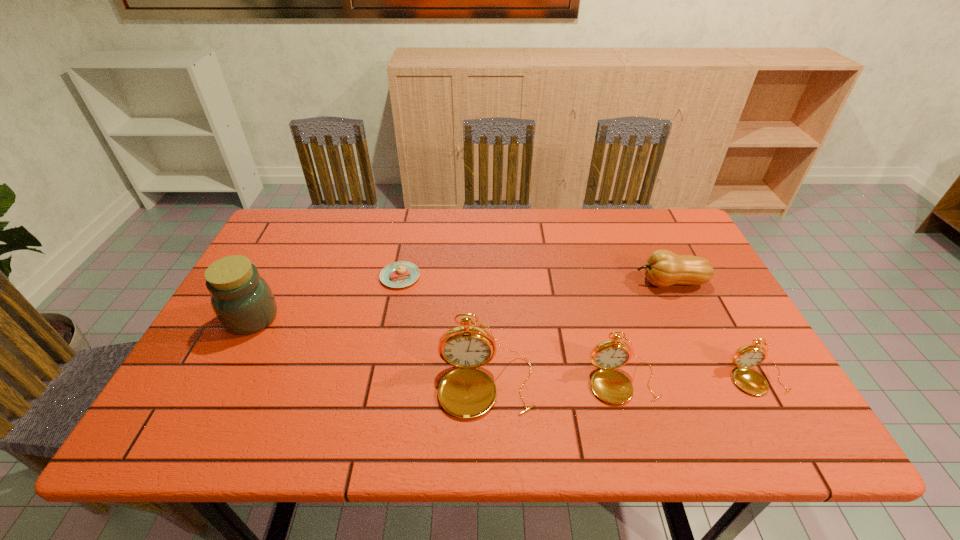
The width and height of the screenshot is (960, 540). In order to click on vacant spot to place a pocket watch on the left in this screenshot , I will do [x=347, y=390].